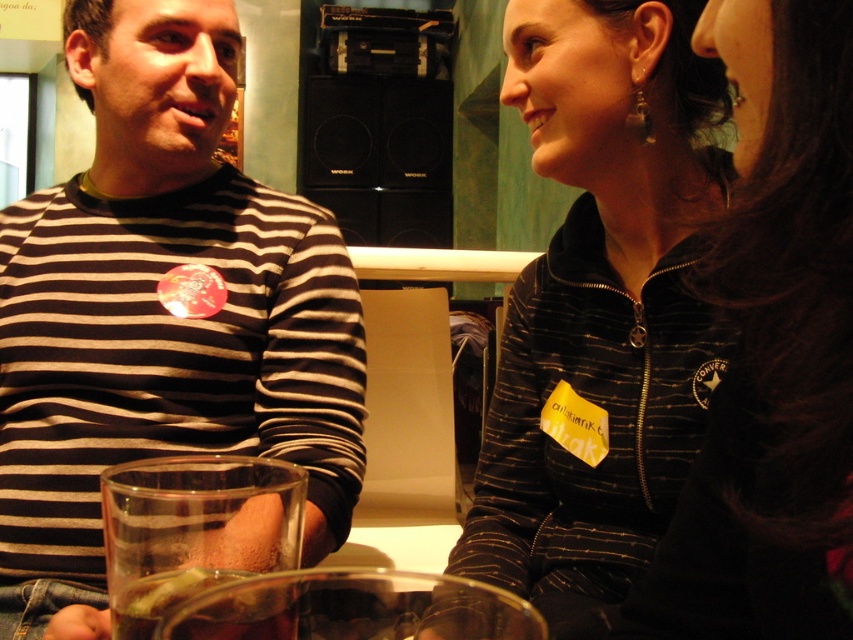
Question: Can you confirm if black striped jacket at upper right is thinner than translucent glass at lower left?

Choices:
 (A) yes
 (B) no

Answer: (B)

Question: Which point is farther to the camera?

Choices:
 (A) black striped jacket at upper right
 (B) striped fabric shirt at left
 (C) translucent glass at lower left
 (D) black zip-up jacket at upper right

Answer: (B)

Question: Can you confirm if black striped jacket at upper right is wider than black zip-up jacket at upper right?

Choices:
 (A) no
 (B) yes

Answer: (B)

Question: Among these points, which one is farthest from the camera?

Choices:
 (A) (218, 577)
 (B) (764, 131)
 (C) (0, 618)

Answer: (C)

Question: Is black zip-up jacket at upper right thinner than translucent glass at lower left?

Choices:
 (A) no
 (B) yes

Answer: (A)

Question: Which object is closer to the camera taking this photo?

Choices:
 (A) black striped jacket at upper right
 (B) translucent glass at lower left
 (C) striped fabric shirt at left

Answer: (B)